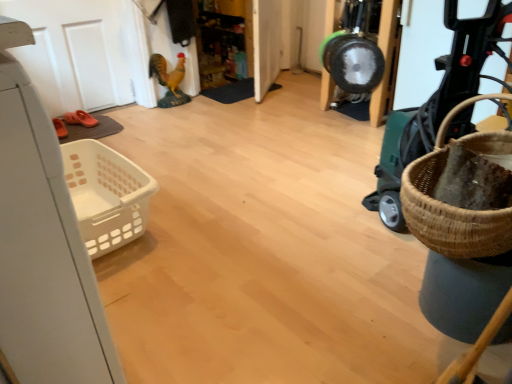
Where is `free space to the back side of green plastic baby carriage at right`? Image resolution: width=512 pixels, height=384 pixels. free space to the back side of green plastic baby carriage at right is located at coordinates (348, 175).